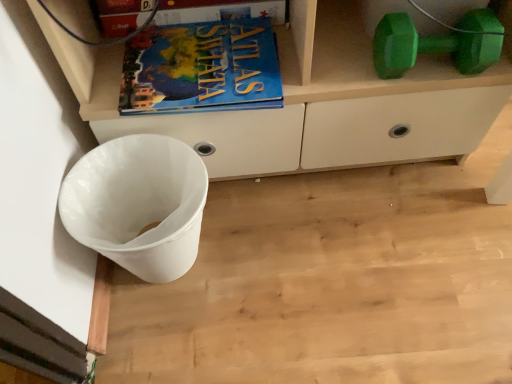
Question: Considering the relative positions of blue matte book at upper center and blue matte atlas book at upper center in the image provided, is blue matte book at upper center to the right of blue matte atlas book at upper center from the viewer's perspective?

Choices:
 (A) yes
 (B) no

Answer: (B)

Question: Is blue matte book at upper center shorter than blue matte atlas book at upper center?

Choices:
 (A) yes
 (B) no

Answer: (B)

Question: Is blue matte book at upper center oriented towards blue matte atlas book at upper center?

Choices:
 (A) yes
 (B) no

Answer: (A)

Question: From a real-world perspective, is blue matte book at upper center below blue matte atlas book at upper center?

Choices:
 (A) yes
 (B) no

Answer: (B)

Question: Considering the relative sizes of blue matte book at upper center and blue matte atlas book at upper center in the image provided, is blue matte book at upper center wider than blue matte atlas book at upper center?

Choices:
 (A) no
 (B) yes

Answer: (A)

Question: From a real-world perspective, is blue matte book at upper center on blue matte atlas book at upper center?

Choices:
 (A) no
 (B) yes

Answer: (B)

Question: Does blue matte atlas book at upper center come in front of white matte cabinet at lower left?

Choices:
 (A) yes
 (B) no

Answer: (B)

Question: Is blue matte atlas book at upper center placed right next to white matte cabinet at lower left?

Choices:
 (A) yes
 (B) no

Answer: (B)

Question: Considering the relative positions of blue matte atlas book at upper center and white matte cabinet at lower left in the image provided, is blue matte atlas book at upper center to the left of white matte cabinet at lower left from the viewer's perspective?

Choices:
 (A) no
 (B) yes

Answer: (B)

Question: From a real-world perspective, is blue matte atlas book at upper center beneath white matte cabinet at lower left?

Choices:
 (A) no
 (B) yes

Answer: (A)

Question: From a real-world perspective, is blue matte atlas book at upper center on white matte cabinet at lower left?

Choices:
 (A) no
 (B) yes

Answer: (B)

Question: Considering the relative sizes of blue matte atlas book at upper center and white matte cabinet at lower left in the image provided, is blue matte atlas book at upper center thinner than white matte cabinet at lower left?

Choices:
 (A) no
 (B) yes

Answer: (B)

Question: Can you confirm if blue matte book at upper center is positioned to the left of white plastic waste bin at lower left?

Choices:
 (A) no
 (B) yes

Answer: (A)